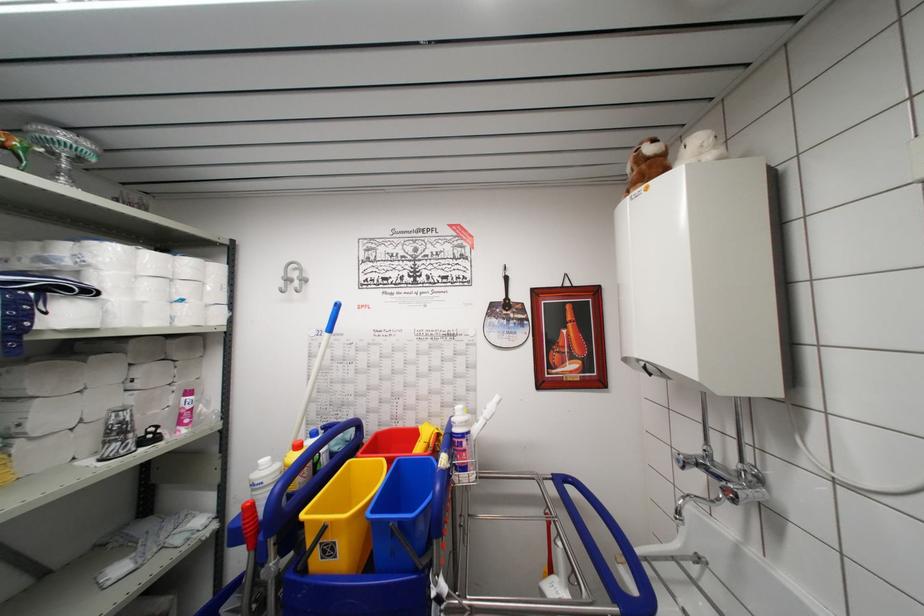
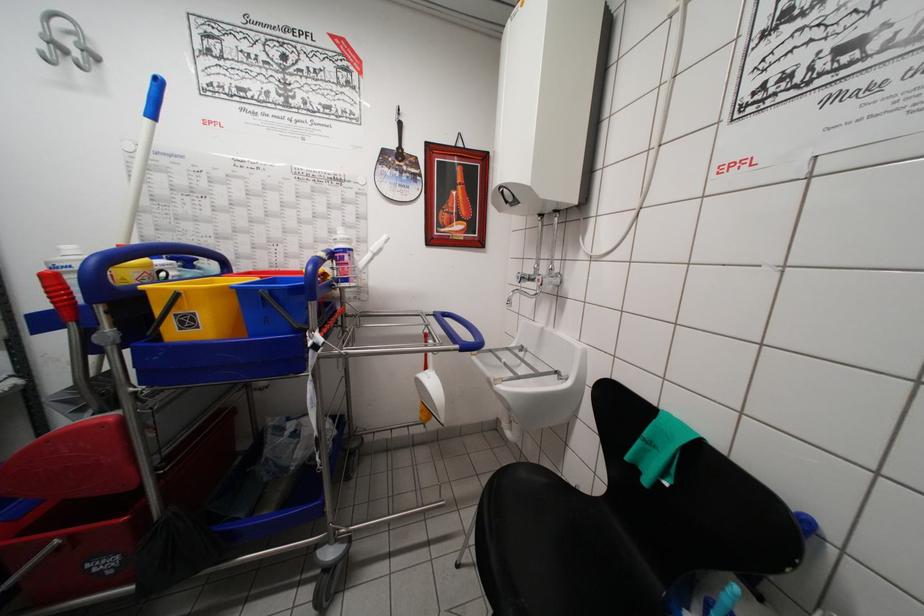
Question: The camera is either moving clockwise (left) or counter-clockwise (right) around the object. The first image is from the beginning of the video and the second image is from the end. Is the camera moving left or right when shooting the video?

Choices:
 (A) Left
 (B) Right

Answer: (A)